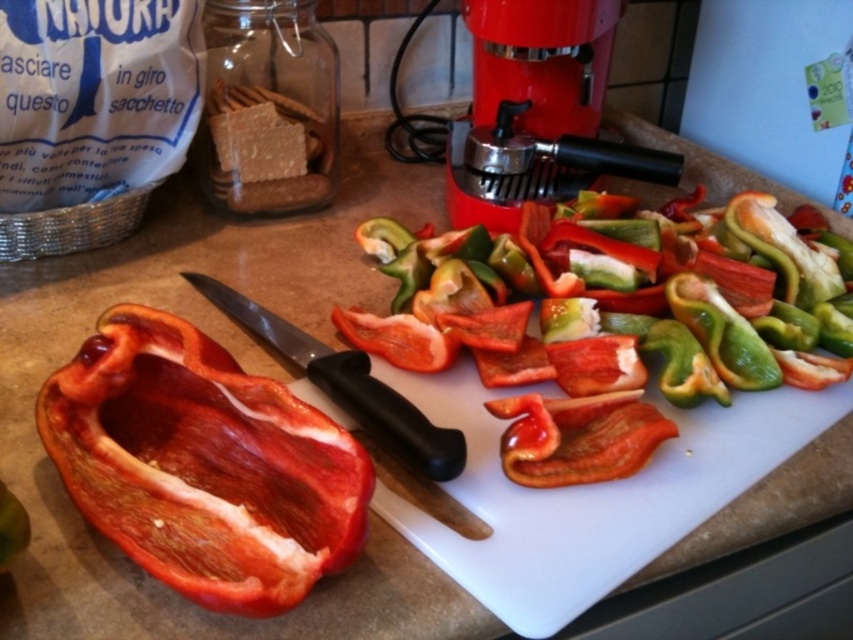
Is red plastic food processor at upper center taller than black plastic knife at center?

Yes.

Can you confirm if red plastic food processor at upper center is bigger than black plastic knife at center?

Indeed, red plastic food processor at upper center has a larger size compared to black plastic knife at center.

Which is in front, point (583, 164) or point (325, 360)?

Point (325, 360)

Where is `red plastic food processor at upper center`? This screenshot has width=853, height=640. red plastic food processor at upper center is located at coordinates (537, 108).

From the picture: Measure the distance between red matte bell pepper at left and camera.

red matte bell pepper at left and camera are 32.12 centimeters apart.

Can you confirm if red matte bell pepper at left is positioned to the left of red plastic food processor at upper center?

Correct, you'll find red matte bell pepper at left to the left of red plastic food processor at upper center.

Which is in front, point (78, 380) or point (577, 177)?

Point (78, 380) is in front.

You are a GUI agent. You are given a task and a screenshot of the screen. Output one action in this format:
    pyautogui.click(x=<x>, y=<y>)
    Task: Click on the red matte bell pepper at left
    The width and height of the screenshot is (853, 640).
    Given the screenshot: What is the action you would take?
    pyautogui.click(x=202, y=465)

Between red matte bell pepper at left and black plastic knife at center, which one appears on the left side from the viewer's perspective?

Positioned to the left is red matte bell pepper at left.

This screenshot has height=640, width=853. Describe the element at coordinates (202, 465) in the screenshot. I see `red matte bell pepper at left` at that location.

At what (x,y) coordinates should I click in order to perform the action: click on red matte bell pepper at left. Please return your answer as a coordinate pair (x, y). Image resolution: width=853 pixels, height=640 pixels. Looking at the image, I should click on (202, 465).